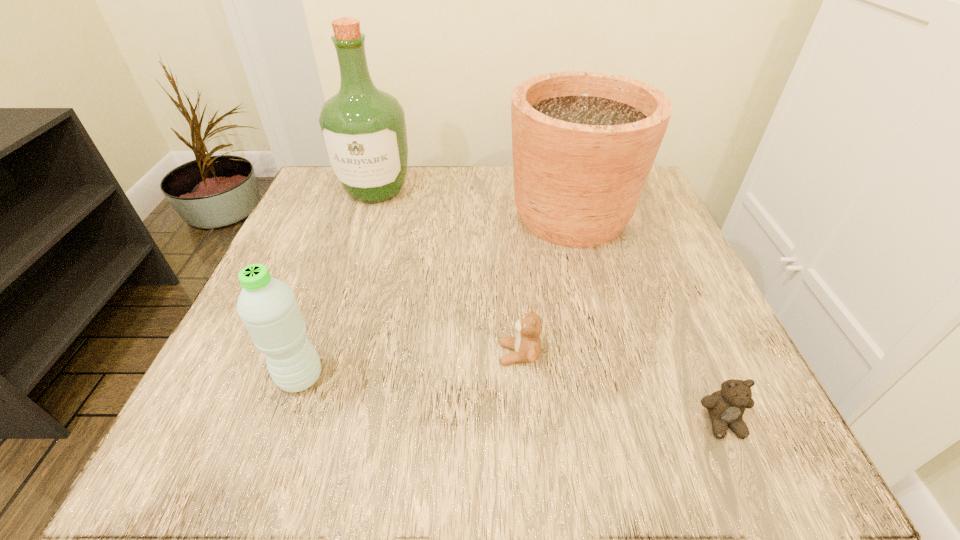
I want to click on the tallest object, so click(x=363, y=129).

This screenshot has height=540, width=960. I want to click on the fourth shortest object, so click(x=584, y=143).

Where is `water bottle`? The image size is (960, 540). water bottle is located at coordinates (268, 308).

At what (x,y) coordinates should I click in order to perform the action: click on the farther teddy bear. Please return your answer as a coordinate pair (x, y). Looking at the image, I should click on (527, 345).

Image resolution: width=960 pixels, height=540 pixels. Identify the location of the nearest object. (726, 407).

Locate an element on the screen. the right teddy bear is located at coordinates (726, 407).

Image resolution: width=960 pixels, height=540 pixels. Identify the location of free space located on the front-facing side of the tallest object. (355, 253).

Image resolution: width=960 pixels, height=540 pixels. I want to click on vacant region located 0.050m on the left of the flowerpot, so click(483, 215).

At what (x,y) coordinates should I click in order to perform the action: click on blank space located on the right of the water bottle. Please return your answer as a coordinate pair (x, y). The width and height of the screenshot is (960, 540). Looking at the image, I should click on (458, 377).

Find the location of a particular element. The image size is (960, 540). free point located 0.380m on the front-facing side of the left teddy bear is located at coordinates (255, 354).